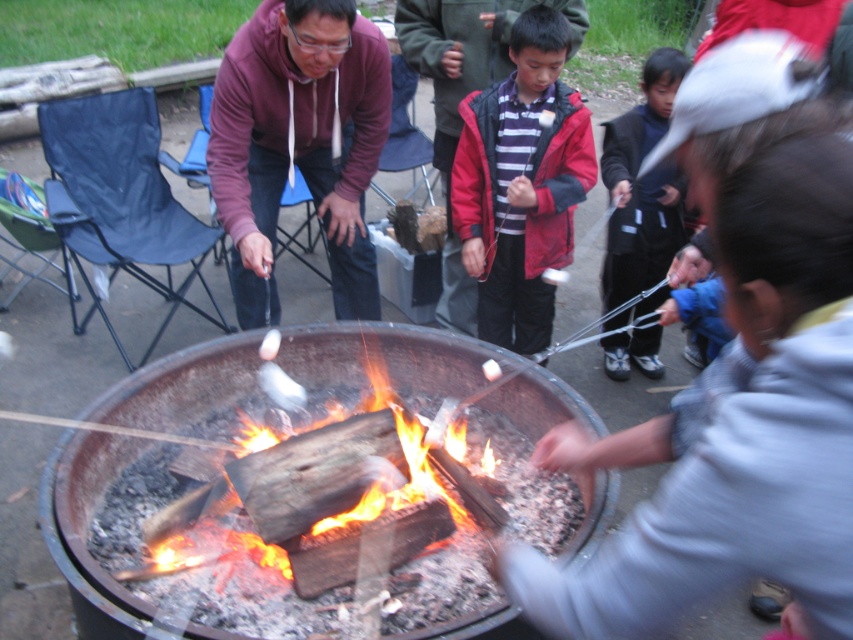
Looking at this image, you are planning to buy a new jacket and want to know which one is narrower between the red matte jacket at center and the blue fleece jacket at lower right. Based on the scene, which one should you choose?

The red matte jacket at center is narrower than the blue fleece jacket at lower right, so you should choose the red matte jacket at center if you want a narrower option.

You are standing in the scene and want to hand a marshmallow to the person wearing the matte purple hoodie at center and dark blue pants at lower right. Which direction should you approach from to reach them?

The matte purple hoodie at center is positioned on the left side of dark blue pants at lower right, so you should approach from the left side of the dark blue pants at lower right to reach them.